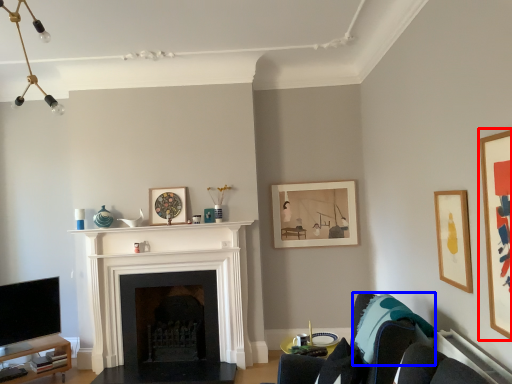
Question: Which object is further to the camera taking this photo, picture frame (highlighted by a red box) or pillow (highlighted by a blue box)?

Choices:
 (A) picture frame
 (B) pillow

Answer: (B)